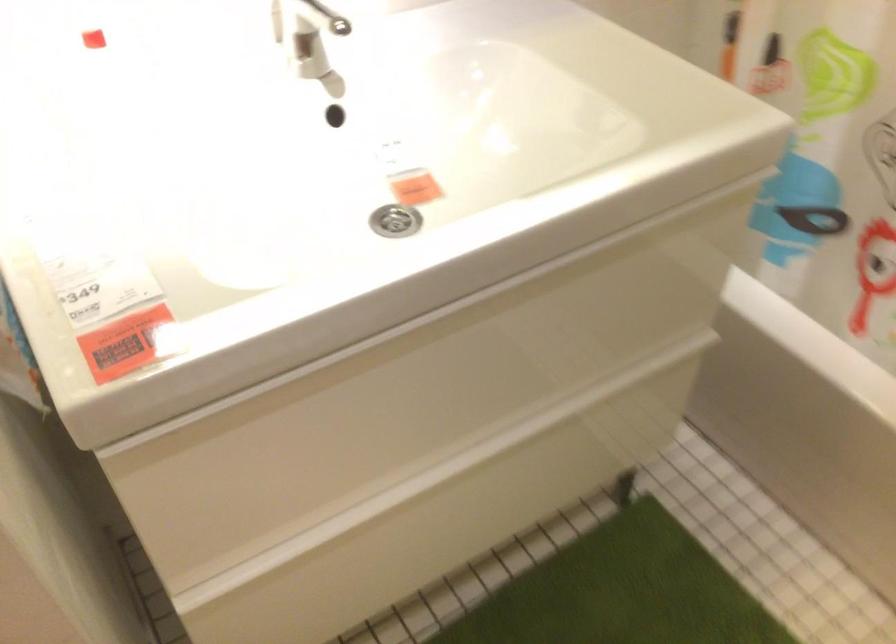
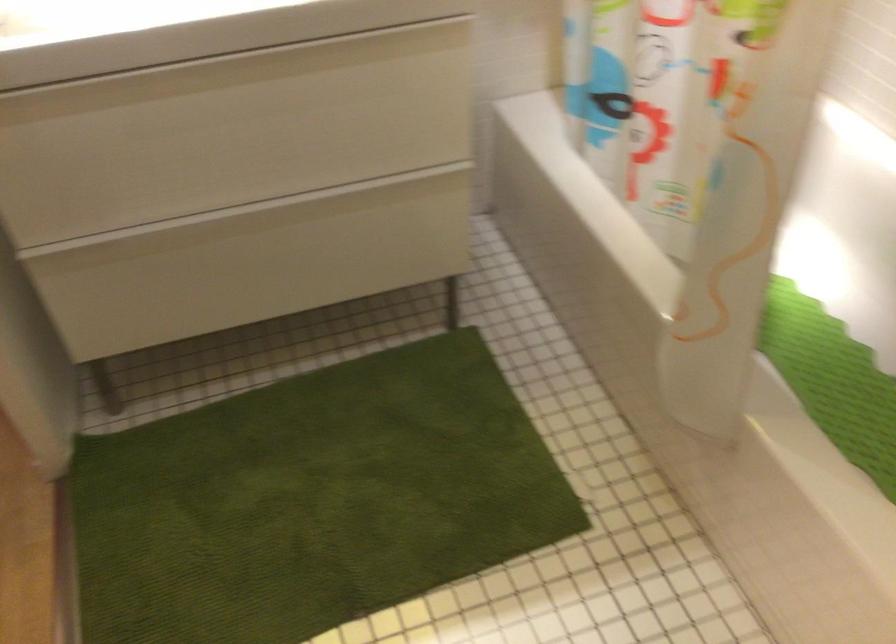
The point at (506, 474) is marked in the first image. Where is the corresponding point in the second image?

(289, 238)